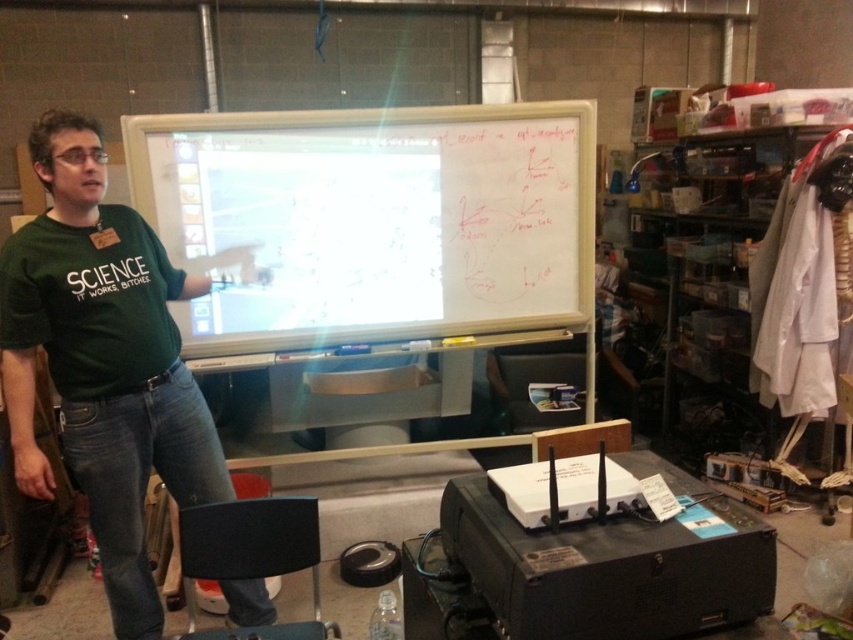
Question: Estimate the real-world distances between objects in this image. Which object is closer to the green fabric shirt at left?

Choices:
 (A) whiteboard at center
 (B) green matte shirt at center

Answer: (B)

Question: Does whiteboard at center have a greater width compared to green matte shirt at center?

Choices:
 (A) no
 (B) yes

Answer: (B)

Question: Can you confirm if green matte shirt at center is wider than green fabric shirt at left?

Choices:
 (A) yes
 (B) no

Answer: (A)

Question: Does whiteboard at center lie in front of green fabric shirt at left?

Choices:
 (A) yes
 (B) no

Answer: (B)

Question: Which object is closer to the camera taking this photo?

Choices:
 (A) whiteboard at center
 (B) green fabric shirt at left
 (C) green matte shirt at center

Answer: (C)

Question: Which of the following is the closest to the observer?

Choices:
 (A) (225, 131)
 (B) (71, 435)
 (C) (86, 292)

Answer: (C)